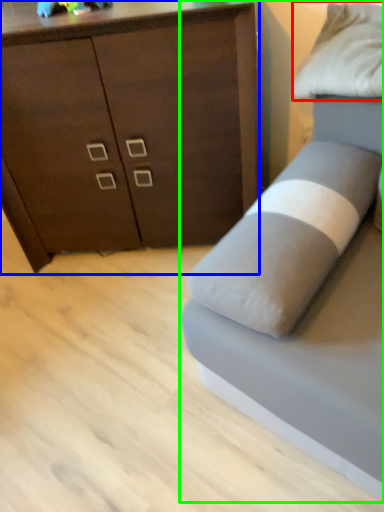
Question: Estimate the real-world distances between objects in this image. Which object is closer to pillow (highlighted by a red box), chest of drawers (highlighted by a blue box) or studio couch (highlighted by a green box)?

Choices:
 (A) chest of drawers
 (B) studio couch

Answer: (B)